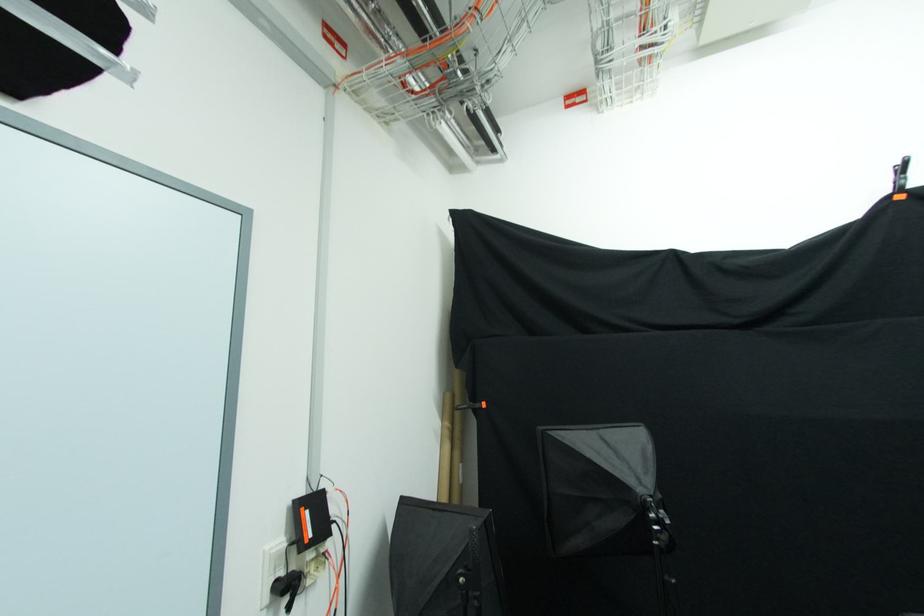
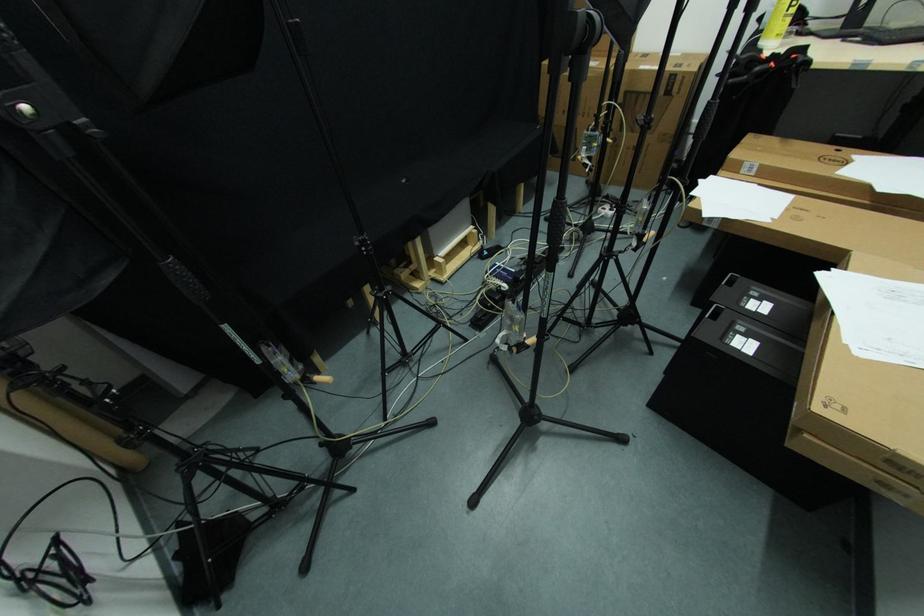
The first image is from the beginning of the video and the second image is from the end. How did the camera likely rotate when shooting the video?

The camera rotated toward right-down.